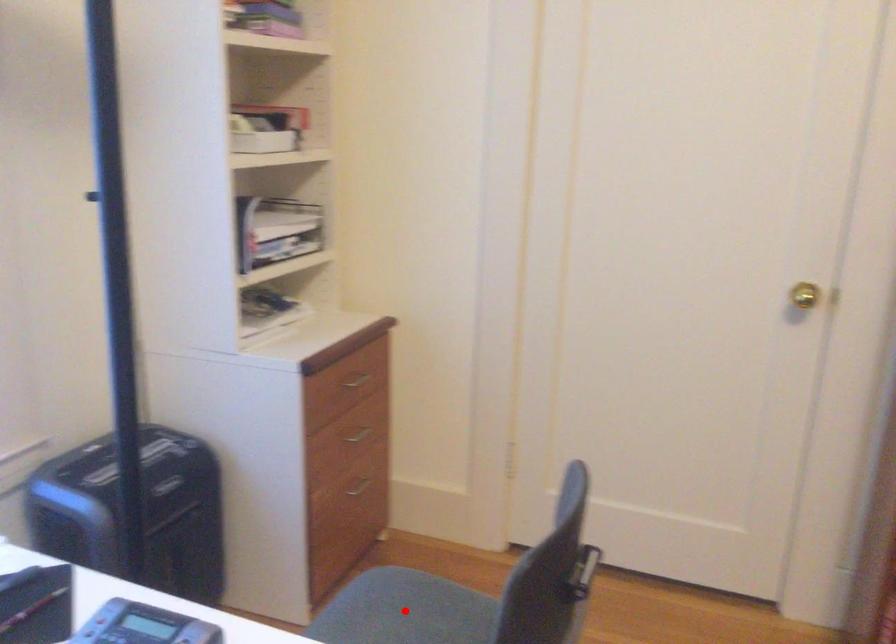
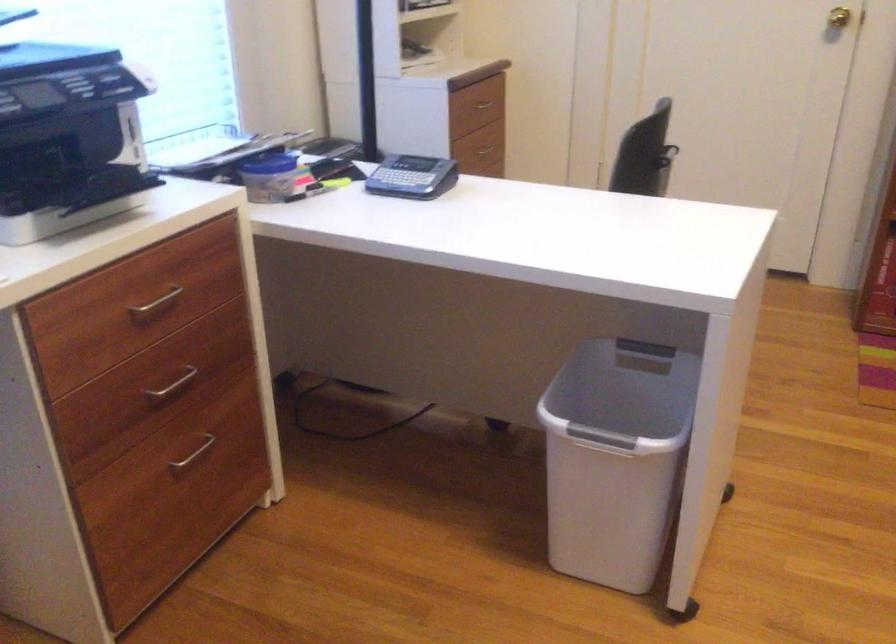
Question: I am providing you with two images of the same scene from different viewpoints. A red point is marked on the first image. Is the red point's position out of view in image 2?

Choices:
 (A) Yes
 (B) No

Answer: (A)